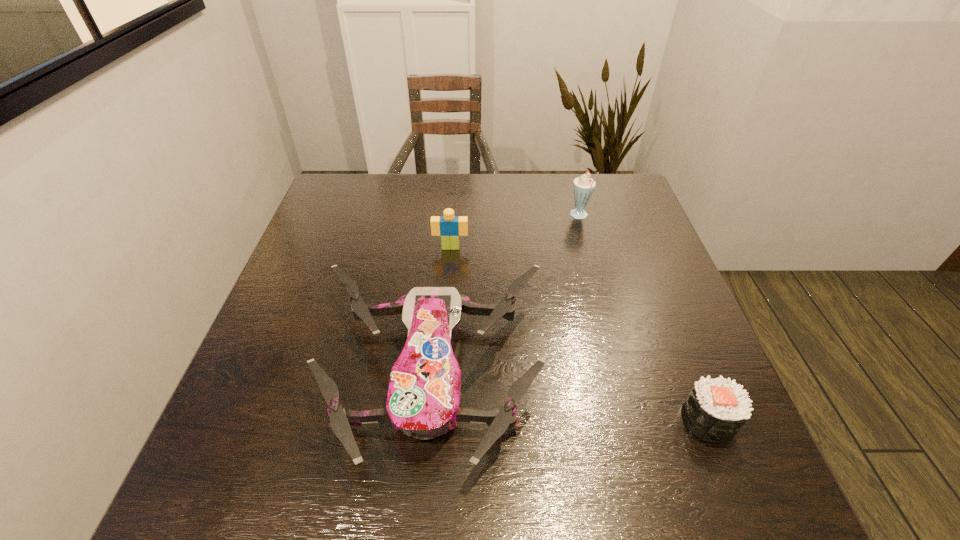
At what (x,y) coordinates should I click in order to perform the action: click on vacant space located 0.340m on the back of the shortest object. Please return your answer as a coordinate pair (x, y). The image size is (960, 540). Looking at the image, I should click on point(651,277).

The height and width of the screenshot is (540, 960). What are the coordinates of `object positioned at the far edge` in the screenshot? It's located at (584, 185).

Image resolution: width=960 pixels, height=540 pixels. Find the location of `object at the near edge`. object at the near edge is located at coordinates (423, 399).

This screenshot has height=540, width=960. I want to click on object that is at the left edge, so click(x=423, y=399).

This screenshot has height=540, width=960. Identify the location of milkshake present at the right edge. (584, 185).

Where is `sushi located in the right edge section of the desktop`? The height and width of the screenshot is (540, 960). sushi located in the right edge section of the desktop is located at coordinates (716, 409).

Identify the location of object at the near left corner. pos(423,399).

The width and height of the screenshot is (960, 540). In order to click on object located at the far right corner in this screenshot , I will do `click(584, 185)`.

At what (x,y) coordinates should I click in order to perform the action: click on free space at the far edge of the desktop. Please return your answer as a coordinate pair (x, y). Looking at the image, I should click on (524, 174).

In the image, there is a desktop. Identify the location of vacant space at the near edge. Image resolution: width=960 pixels, height=540 pixels. (373, 489).